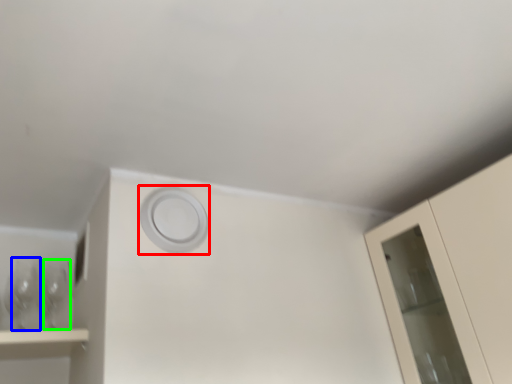
Question: Considering the real-world distances, which object is farthest from circle (highlighted by a red box)? wine glass (highlighted by a blue box) or wine glass (highlighted by a green box)?

Choices:
 (A) wine glass
 (B) wine glass

Answer: (A)